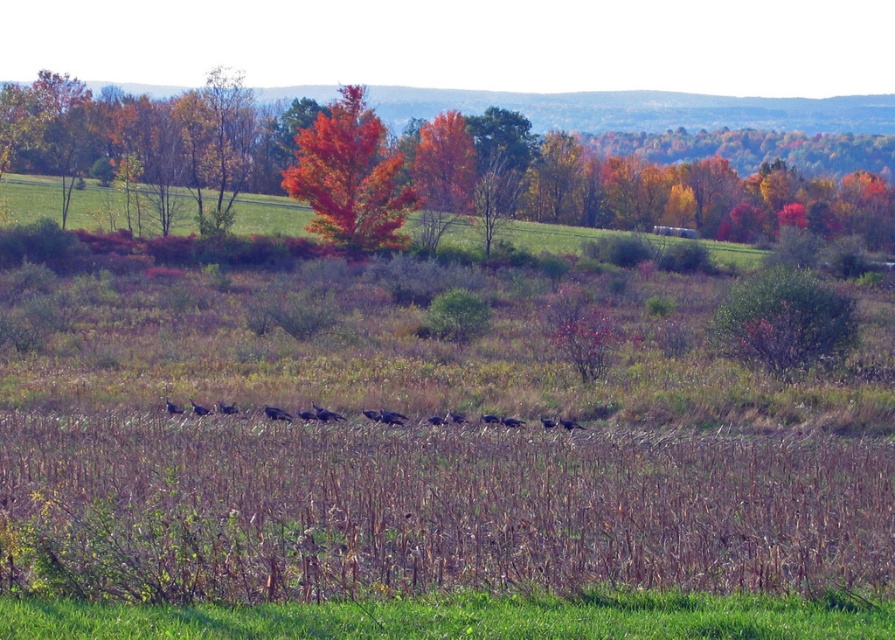
In the scene shown: You are an artist painting this autumn scene. You need to paint the orange leafy tree at upper center and the vivid orange leaves at center. Which one should you paint first if you want to follow the standard painting technique of starting with the background elements first?

The orange leafy tree at upper center should be painted first because it is located above the vivid orange leaves at center, making it part of the background in the scene.

You are standing in the field of dried stalks and see the orange leafy tree at upper center and the vivid orange leaves at center. Which object is positioned to the right of the other?

The orange leafy tree at upper center is to the right of the vivid orange leaves at center.